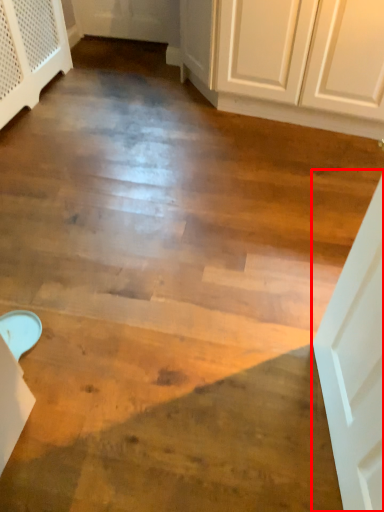
Question: From the image's perspective, considering the relative positions of door (annotated by the red box) and dresser in the image provided, where is door (annotated by the red box) located with respect to the staircase?

Choices:
 (A) below
 (B) above

Answer: (A)